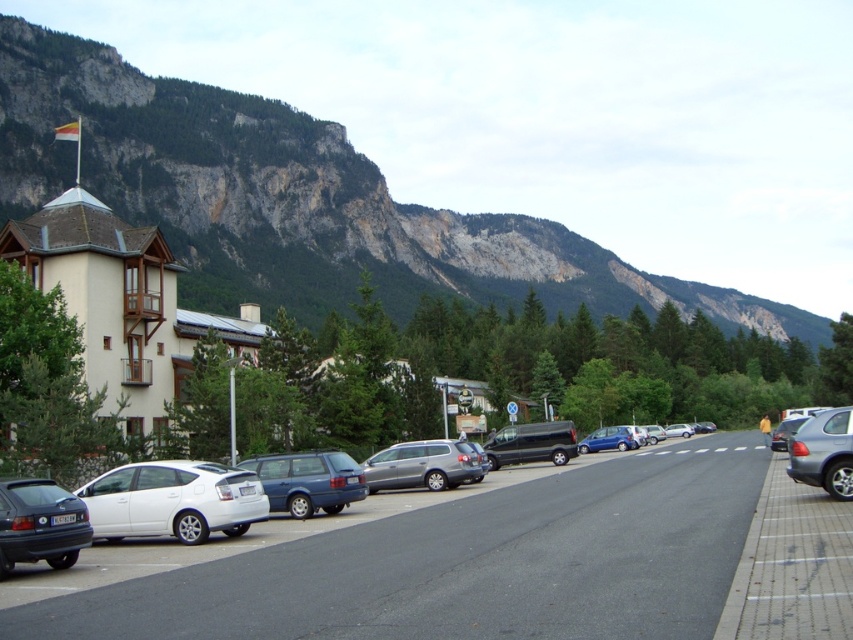
Question: Estimate the real-world distances between objects in this image. Which object is farther from the satin silver station wagon at center?

Choices:
 (A) white matte hatchback at lower left
 (B) matte black car at lower left
 (C) rocky cliff at upper center

Answer: (C)

Question: Which of the following is the farthest from the observer?

Choices:
 (A) shiny black van at center
 (B) satin silver station wagon at center
 (C) satin silver sedan at right

Answer: (A)

Question: Based on their relative distances, which object is nearer to the rocky cliff at upper center?

Choices:
 (A) matte black car at lower left
 (B) matte blue station wagon at center
 (C) shiny black van at center
 (D) satin silver station wagon at center

Answer: (A)

Question: Does white matte hatchback at center appear on the right side of matte black car at lower left?

Choices:
 (A) no
 (B) yes

Answer: (B)

Question: Does silver metallic suv at right appear on the right side of satin silver sedan at right?

Choices:
 (A) yes
 (B) no

Answer: (B)

Question: Is satin silver station wagon at center to the left of satin silver sedan at right from the viewer's perspective?

Choices:
 (A) yes
 (B) no

Answer: (A)